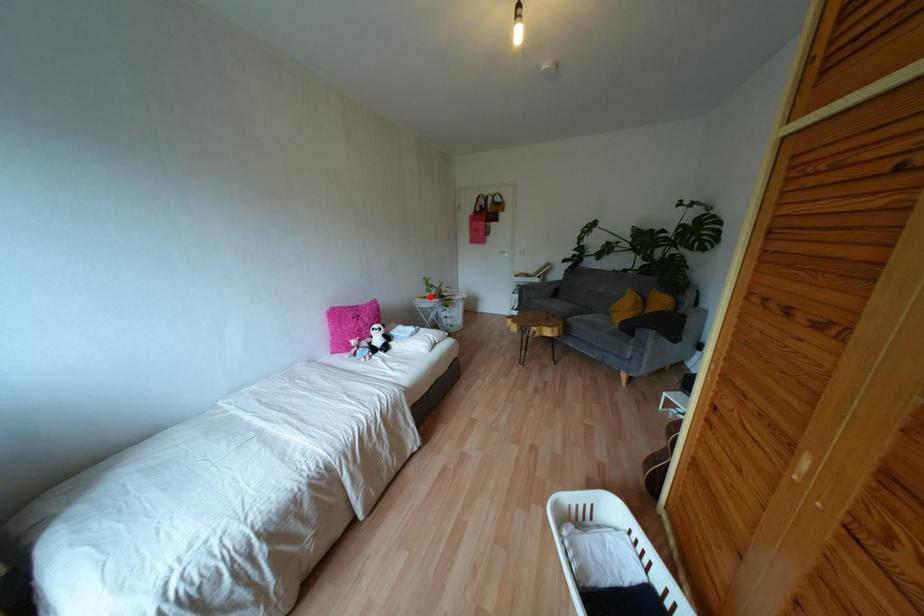
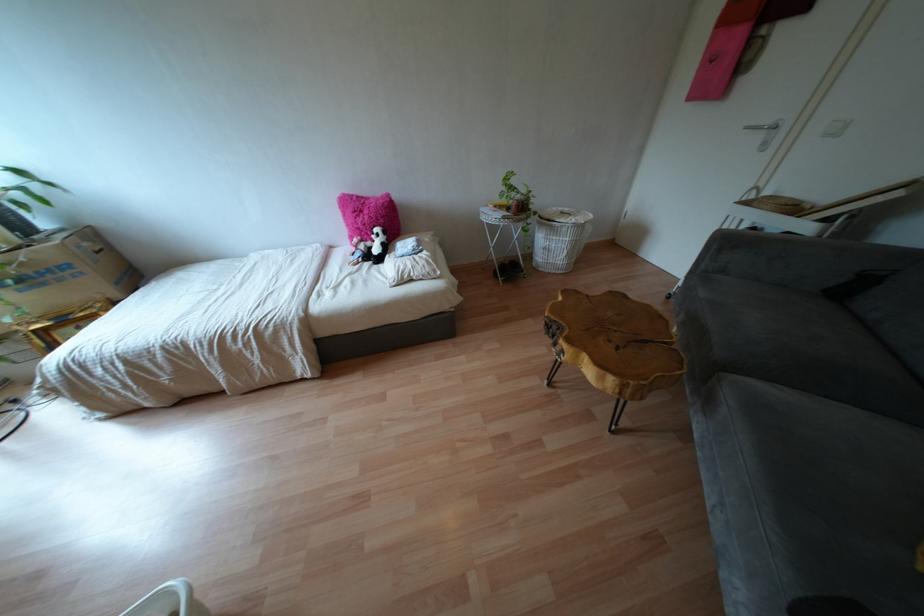
Locate, in the second image, the point that corresponds to the highlighted location in the first image.

(506, 208)